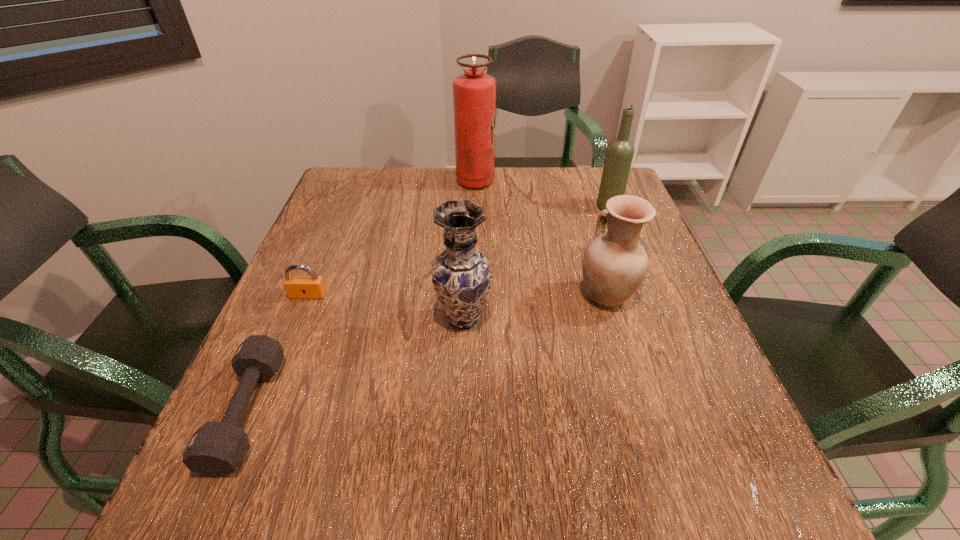
Locate an element on the screen. The image size is (960, 540). vacant position located on the left of the vase is located at coordinates (283, 319).

Identify the location of free space located 0.200m on the left of the pottery. The height and width of the screenshot is (540, 960). (490, 295).

What are the coordinates of `free space located 0.300m to unlock the padlock from the front` in the screenshot? It's located at (256, 420).

Find the location of a particular element. This screenshot has width=960, height=540. free spot located on the back of the shortest object is located at coordinates (291, 312).

Find the location of a particular element. fire extinguisher situated at the far edge is located at coordinates (474, 93).

Image resolution: width=960 pixels, height=540 pixels. I want to click on wine bottle that is at the far edge, so click(619, 154).

This screenshot has height=540, width=960. What are the coordinates of `object that is at the near edge` in the screenshot? It's located at (216, 449).

Locate an element on the screen. This screenshot has width=960, height=540. padlock located in the left edge section of the desktop is located at coordinates (297, 287).

Image resolution: width=960 pixels, height=540 pixels. In order to click on dumbbell positioned at the left edge in this screenshot , I will do `click(216, 449)`.

Where is `wine bottle situated at the right edge`? wine bottle situated at the right edge is located at coordinates (619, 154).